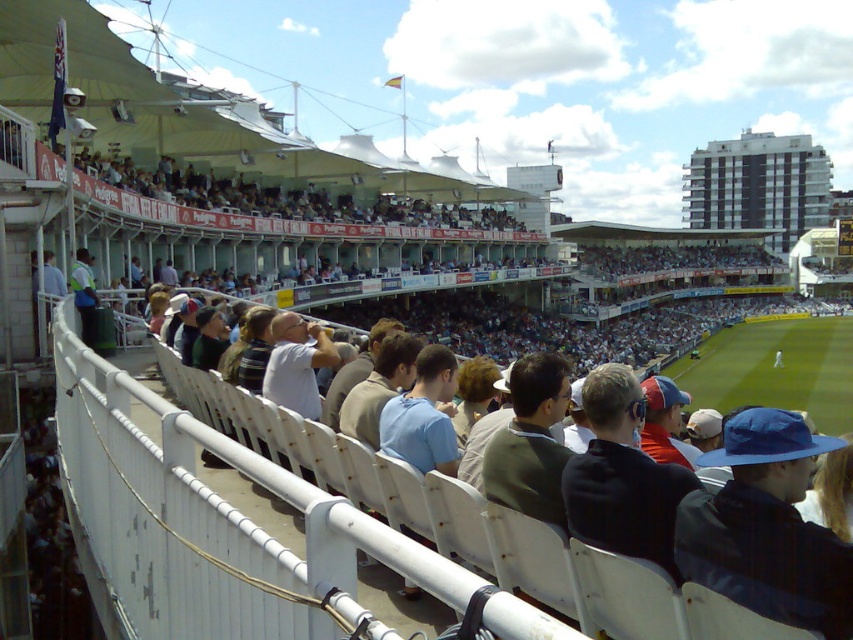
You are a spectator at the cricket match and want to place your dark blue cap at center on top of the light brown wooden bench at upper center. Can you do this without the cap falling off?

The dark blue cap at center is thinner than light brown wooden bench at upper center, so it can be placed on top without falling off since its width is narrower than the bench.

You are a spectator at the cricket match and need to place your light brown leather jacket at center on the light brown wooden bench at upper center. Will the jacket fit on the bench?

The light brown wooden bench at upper center is wider than the light brown leather jacket at center, so the jacket will fit on the bench.

You are a photographer standing at the camera position. You want to capture a closeup shot of the light brown wooden bench at upper center. Considering the distance, would you need a zoom lens with a 100mm focal length to achieve this? Explain your reasoning.

The light brown wooden bench at upper center is 65.74 meters away from the camera. A zoom lens with a 100mm focal length may not be sufficient to capture a closeup shot from this distance, as 100mm is considered a standard focal length and might not provide enough magnification for such a distant subject. A longer focal length, like 300mm or higher, would be more appropriate for this purpose.